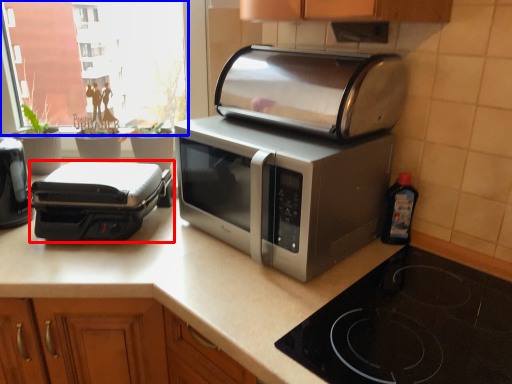
Question: Which object is further to the camera taking this photo, toaster (highlighted by a red box) or window screen (highlighted by a blue box)?

Choices:
 (A) toaster
 (B) window screen

Answer: (B)